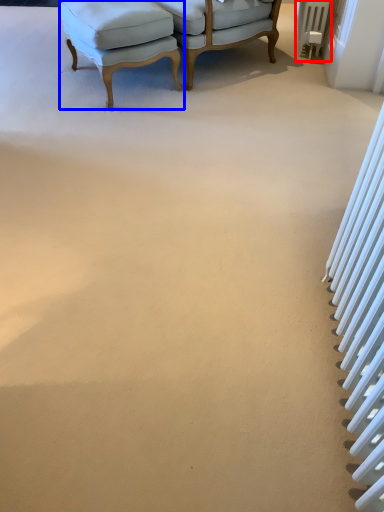
Question: Which of the following is the farthest to the observer, radiator (highlighted by a red box) or chair (highlighted by a blue box)?

Choices:
 (A) radiator
 (B) chair

Answer: (A)